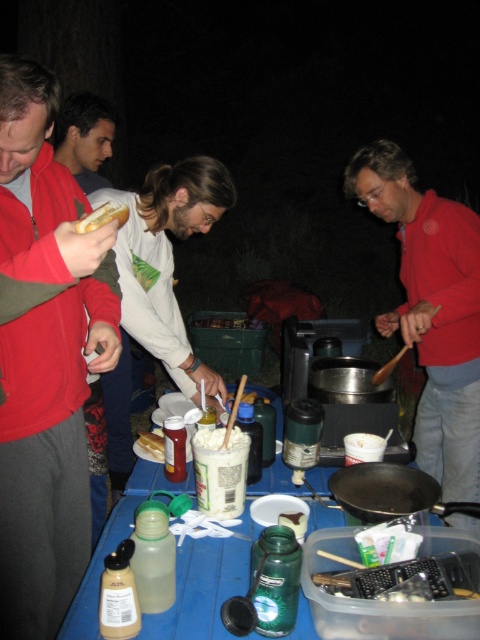
Is smooth brown hair at center bigger than slightly toasted bread at center?

Yes.

Can you confirm if smooth brown hair at center is positioned to the left of slightly toasted bread at center?

Correct, you'll find smooth brown hair at center to the left of slightly toasted bread at center.

Is point (81, 109) farther from camera compared to point (151, 436)?

Yes.

Where is `smooth brown hair at center`? smooth brown hair at center is located at coordinates (84, 138).

Is point (74, 349) farther from camera compared to point (457, 424)?

No, (74, 349) is in front of (457, 424).

The width and height of the screenshot is (480, 640). In order to click on matte red jacket at left in this screenshot , I will do `click(45, 356)`.

This screenshot has width=480, height=640. In order to click on matte red jacket at left in this screenshot , I will do `click(45, 356)`.

Measure the distance between matte red jacket at center and camera.

A distance of 6.39 feet exists between matte red jacket at center and camera.

Where is `matte red jacket at center`? Image resolution: width=480 pixels, height=640 pixels. matte red jacket at center is located at coordinates (432, 308).

I want to click on matte red jacket at center, so click(432, 308).